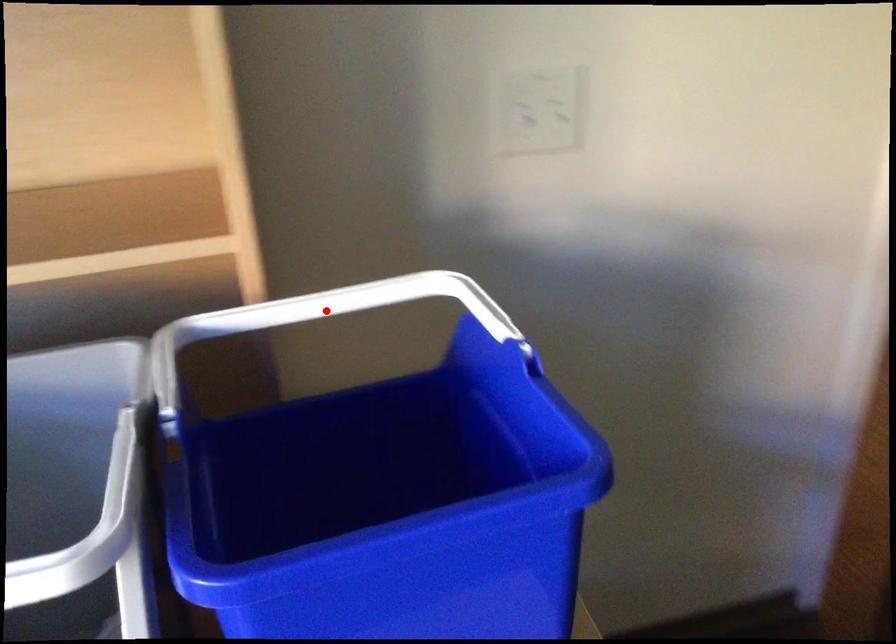
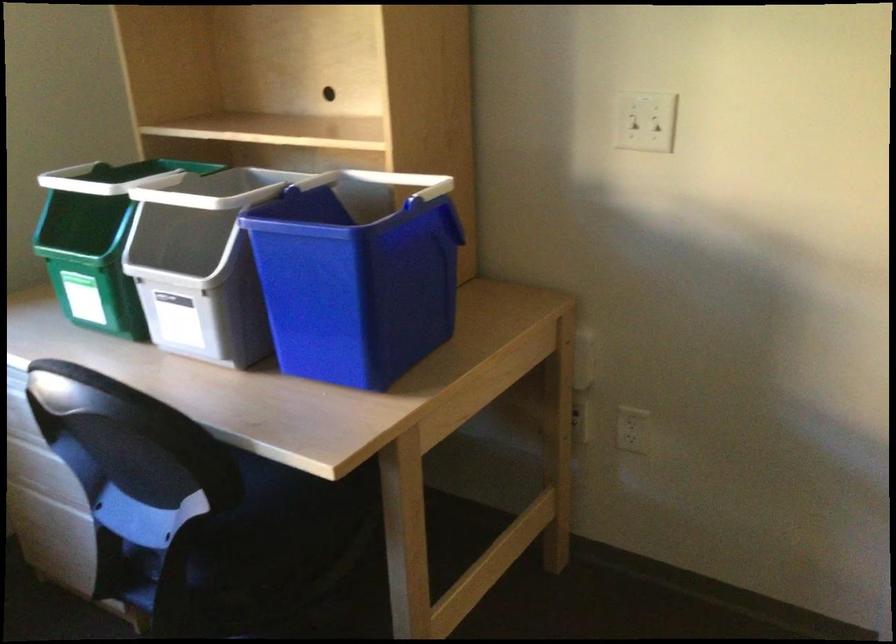
In the second image, find the point that corresponds to the highlighted location in the first image.

(399, 181)